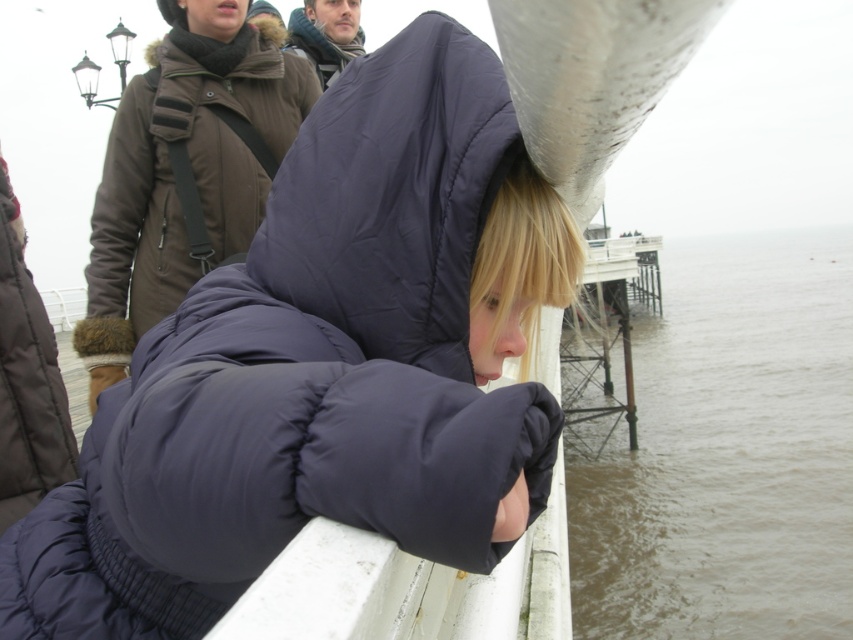
You are a photographer trying to capture two people in the scene. The subjects are wearing the navy blue puffer jacket at center and the dark brown puffy coat at upper center. Based on their sizes in the image, which subject would you position closer to the camera to ensure both appear equally sized in the photo?

The navy blue puffer jacket at center is wider than the dark brown puffy coat at upper center. To make them appear equally sized in the photo, position the narrower dark brown puffy coat at upper center closer to the camera while keeping the wider navy blue puffer jacket at center farther back.

You are standing at the seaside pier and notice the brown murky water at lower right and the dark brown puffy coat at upper center. Which object is positioned higher from the ground?

The brown murky water at lower right is located above the dark brown puffy coat at upper center, so the brown murky water at lower right is higher.